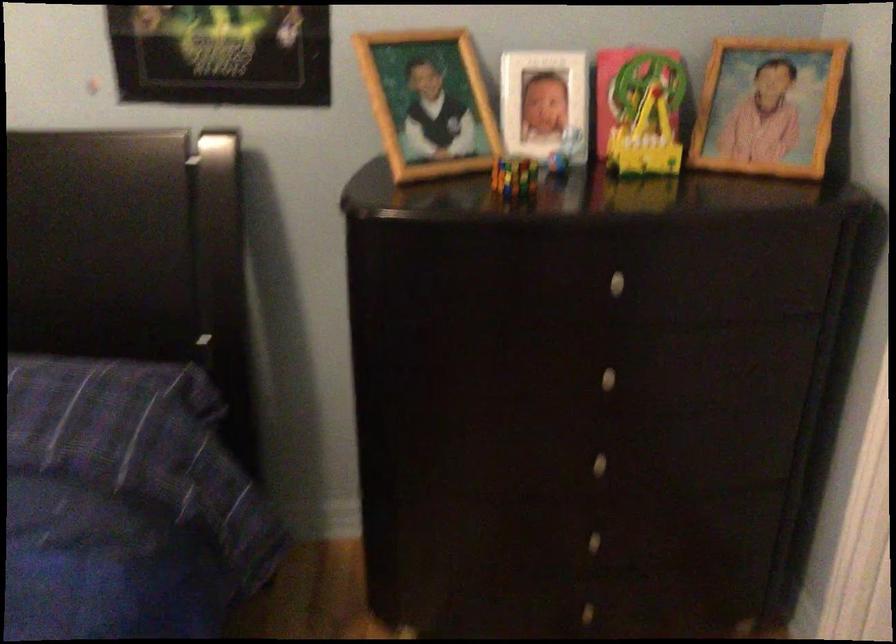
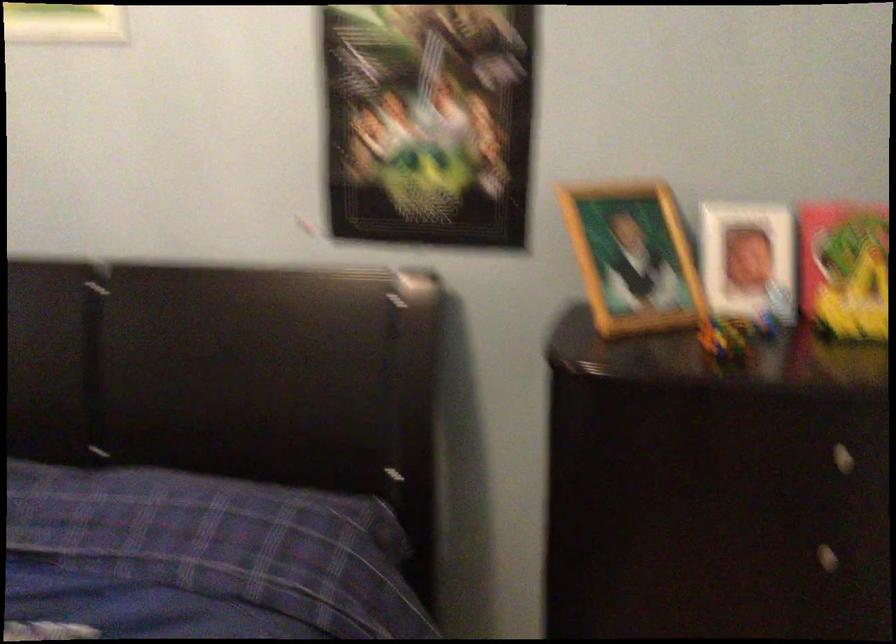
Where in the second image is the point corresponding to (433,109) from the first image?

(633, 258)